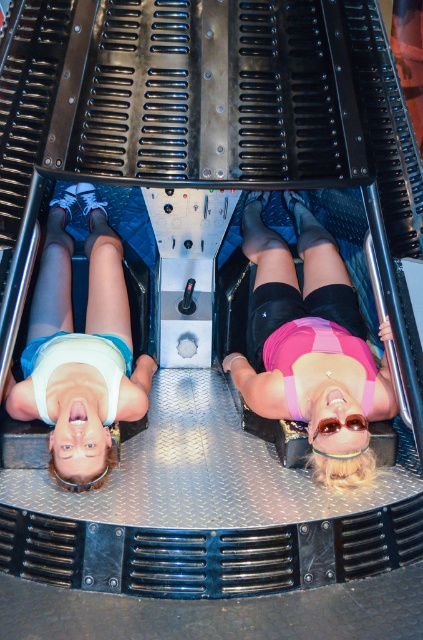
You are an engineer inspecting the centrifuge machine. You notice the pink matte fabric at center and the white matte tank top at upper center. Which object is closer to your viewpoint?

The pink matte fabric at center is closer to the viewer than the white matte tank top at upper center.

You are designing a safety harness for the centrifuge machine. The harness needs to accommodate both the pink matte fabric at center and the white matte tank top at upper center. Based on their widths, which object requires more space in the harness design?

The pink matte fabric at center requires more space in the harness design because it might be wider than the white matte tank top at upper center.